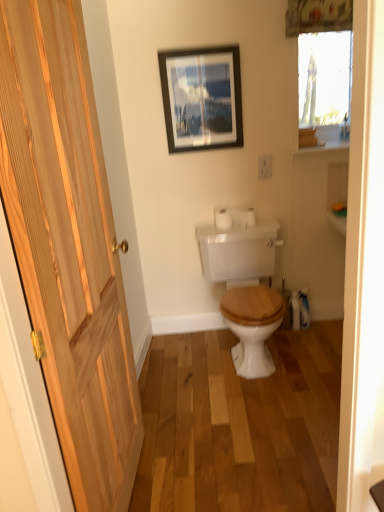
Question: Can you confirm if floral fabric curtain at upper center is positioned to the right of natural wood door at left?

Choices:
 (A) no
 (B) yes

Answer: (B)

Question: From the image's perspective, is floral fabric curtain at upper center located beneath natural wood door at left?

Choices:
 (A) no
 (B) yes

Answer: (A)

Question: From the image's perspective, is floral fabric curtain at upper center over natural wood door at left?

Choices:
 (A) yes
 (B) no

Answer: (A)

Question: Considering the relative sizes of floral fabric curtain at upper center and natural wood door at left in the image provided, is floral fabric curtain at upper center taller than natural wood door at left?

Choices:
 (A) yes
 (B) no

Answer: (B)

Question: From a real-world perspective, is floral fabric curtain at upper center located beneath natural wood door at left?

Choices:
 (A) no
 (B) yes

Answer: (A)

Question: Considering the relative positions of floral fabric curtain at upper center and white matte toilet paper at center in the image provided, is floral fabric curtain at upper center to the left or to the right of white matte toilet paper at center?

Choices:
 (A) left
 (B) right

Answer: (B)

Question: Considering the positions of point (344, 19) and point (241, 210), is point (344, 19) closer or farther from the camera than point (241, 210)?

Choices:
 (A) farther
 (B) closer

Answer: (B)

Question: Is floral fabric curtain at upper center bigger or smaller than white matte toilet paper at center?

Choices:
 (A) small
 (B) big

Answer: (B)

Question: Considering the positions of floral fabric curtain at upper center and white matte toilet paper at center in the image, is floral fabric curtain at upper center wider or thinner than white matte toilet paper at center?

Choices:
 (A) thin
 (B) wide

Answer: (A)

Question: Based on their sizes in the image, would you say matte black picture frame at upper center is bigger or smaller than white matte toilet paper at center?

Choices:
 (A) big
 (B) small

Answer: (A)

Question: From the image's perspective, is matte black picture frame at upper center above or below white matte toilet paper at center?

Choices:
 (A) below
 (B) above

Answer: (B)

Question: Visually, is matte black picture frame at upper center positioned to the left or to the right of white matte toilet paper at center?

Choices:
 (A) left
 (B) right

Answer: (A)

Question: In terms of width, does matte black picture frame at upper center look wider or thinner when compared to white matte toilet paper at center?

Choices:
 (A) thin
 (B) wide

Answer: (A)

Question: From a real-world perspective, is natural wood door at left physically located above or below floral fabric curtain at upper center?

Choices:
 (A) above
 (B) below

Answer: (B)

Question: Visually, is natural wood door at left positioned to the left or to the right of floral fabric curtain at upper center?

Choices:
 (A) right
 (B) left

Answer: (B)